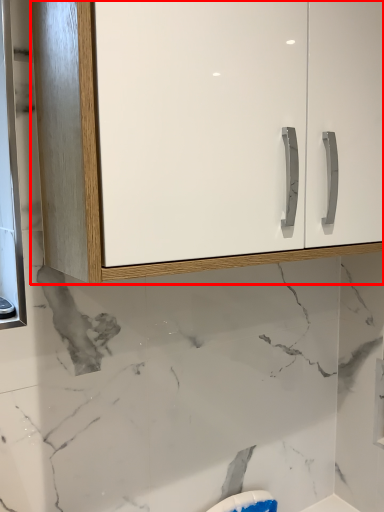
Question: Considering the relative positions of cabinetry (annotated by the red box) and medicine cabinet in the image provided, where is cabinetry (annotated by the red box) located with respect to the staircase?

Choices:
 (A) left
 (B) right

Answer: (B)